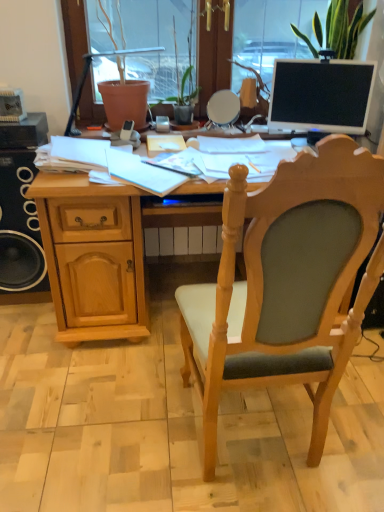
This screenshot has width=384, height=512. What are the coordinates of `vacant space in front of satin silver phone at center, which ranks as the 1th mobile phone in right-to-left order` in the screenshot? It's located at (164, 132).